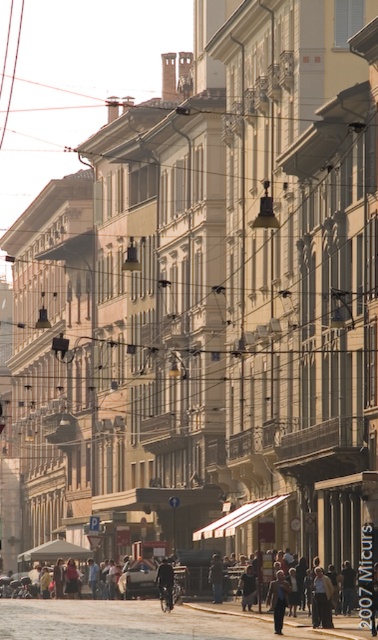
Is dark gray fabric jacket at center bigger than dark gray jacket at center?

Correct, dark gray fabric jacket at center is larger in size than dark gray jacket at center.

Can you confirm if dark gray fabric jacket at center is positioned below dark gray jacket at center?

No.

Who is more forward, (254, 580) or (213, 556)?

Point (254, 580) is in front.

The image size is (378, 640). I want to click on dark gray fabric jacket at center, so click(247, 588).

Does shiny black car at center have a larger size compared to dark gray fabric jacket at center?

Indeed, shiny black car at center has a larger size compared to dark gray fabric jacket at center.

Which is in front, point (176, 566) or point (247, 570)?

Point (247, 570) is more forward.

Identify the location of shiny black car at center. (139, 579).

Does dark blue fabric jacket at center have a lesser width compared to dark gray jacket at center?

No.

Between dark blue fabric jacket at center and dark gray jacket at center, which one has less height?

dark gray jacket at center

Locate an element on the screen. dark blue fabric jacket at center is located at coordinates (165, 582).